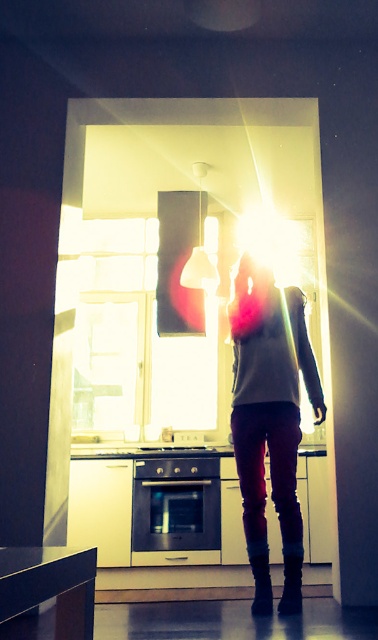
Question: Among these points, which one is farthest from the camera?

Choices:
 (A) (297, 326)
 (B) (202, 547)

Answer: (B)

Question: Which of the following is the closest to the observer?

Choices:
 (A) matte gray sweater at center
 (B) black suede boot at lower center

Answer: (B)

Question: Is metallic oven at center above black suede boot at lower center?

Choices:
 (A) yes
 (B) no

Answer: (A)

Question: Which point is closer to the camera?

Choices:
 (A) matte gray sweater at center
 (B) black suede boot at lower center

Answer: (B)

Question: Considering the relative positions of matte gray sweater at center and black suede boot at lower center in the image provided, where is matte gray sweater at center located with respect to black suede boot at lower center?

Choices:
 (A) above
 (B) below

Answer: (A)

Question: Can you confirm if leather boot at lower center is smaller than black suede boot at lower center?

Choices:
 (A) yes
 (B) no

Answer: (B)